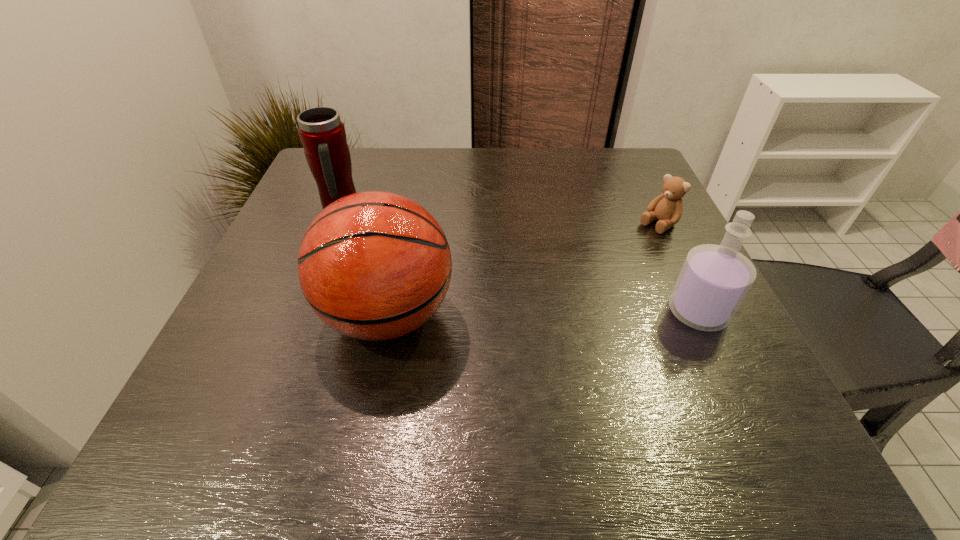
Locate an element on the screen. The image size is (960, 540). basketball is located at coordinates (374, 265).

Image resolution: width=960 pixels, height=540 pixels. In order to click on perfume in this screenshot , I will do `click(714, 279)`.

Identify the location of thermos bottle. (322, 133).

Where is `the shortest object`? Image resolution: width=960 pixels, height=540 pixels. the shortest object is located at coordinates (667, 207).

Where is `free location located on the side with spill of the basketball`? free location located on the side with spill of the basketball is located at coordinates (240, 315).

Locate an element on the screen. This screenshot has height=540, width=960. vacant region located on the side with spill of the basketball is located at coordinates (240, 315).

Locate an element on the screen. Image resolution: width=960 pixels, height=540 pixels. vacant space positioned on the side with spill of the basketball is located at coordinates (240, 315).

Identify the location of free space located on the left of the perfume. (518, 312).

Find the location of a particular element. free space located 0.080m on the side with the handle of the thermos bottle is located at coordinates tap(378, 227).

You are a GUI agent. You are given a task and a screenshot of the screen. Output one action in this format:
    pyautogui.click(x=<x>, y=<y>)
    Task: Click on the vacant area situated 0.150m on the side with the handle of the thermos bottle
    The width and height of the screenshot is (960, 540).
    Given the screenshot: What is the action you would take?
    pyautogui.click(x=401, y=238)